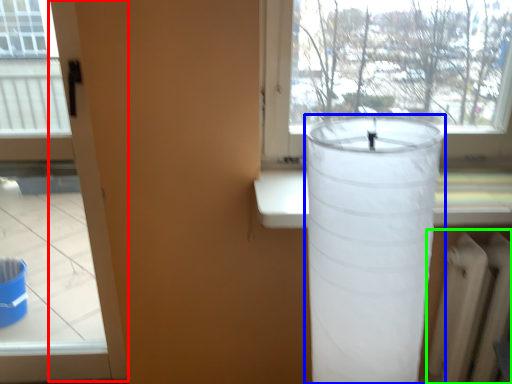
Question: Which is farther away from screen door (highlighted by a red box)? lamp (highlighted by a blue box) or radiator (highlighted by a green box)?

Choices:
 (A) lamp
 (B) radiator

Answer: (B)